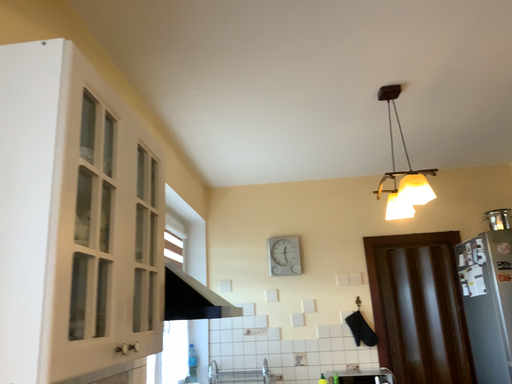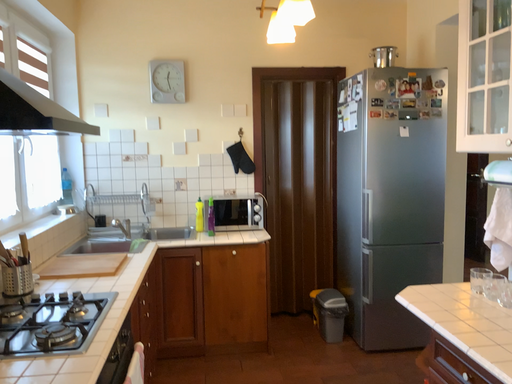
Question: How did the camera likely rotate when shooting the video?

Choices:
 (A) rotated downward
 (B) rotated upward

Answer: (A)